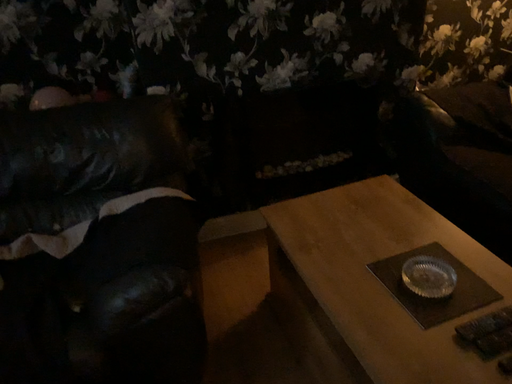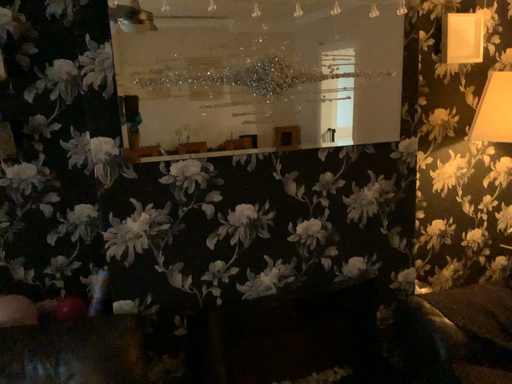
Question: How did the camera likely rotate when shooting the video?

Choices:
 (A) rotated upward
 (B) rotated downward

Answer: (A)